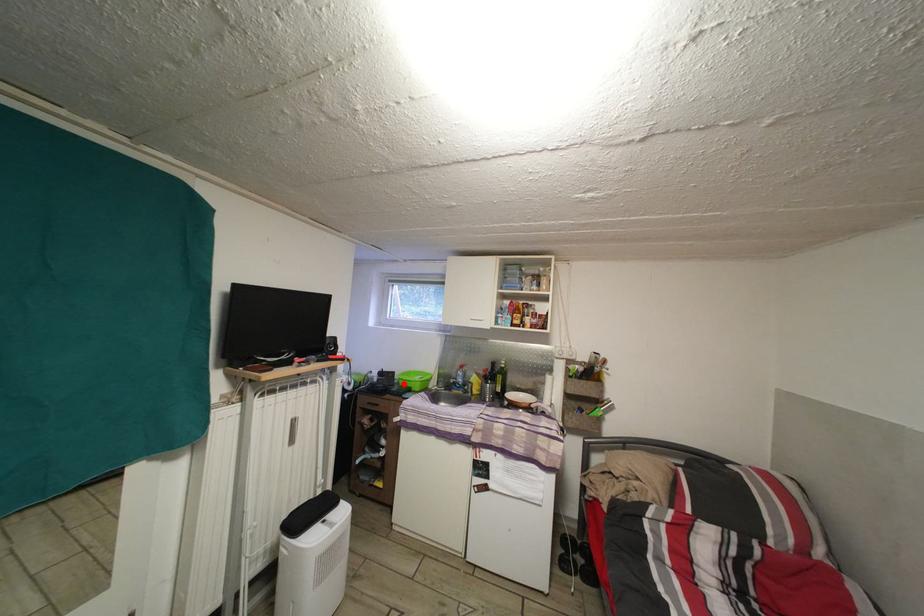
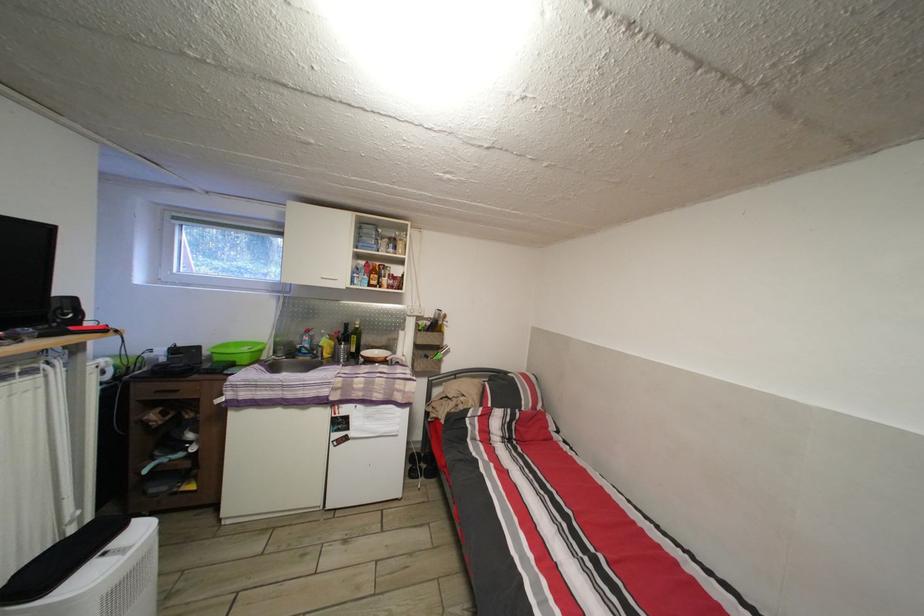
Question: I am providing you with two images of the same scene from different viewpoints. A red point is shown in image1. For the corresponding object point in image2, is it positioned nearer or farther from the camera?

Choices:
 (A) Nearer
 (B) Farther

Answer: (A)